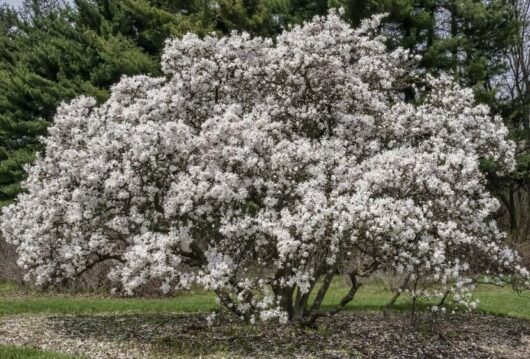
Locate an element on the screen. Image resolution: width=530 pixels, height=359 pixels. white pedistals on ground is located at coordinates (90, 347).